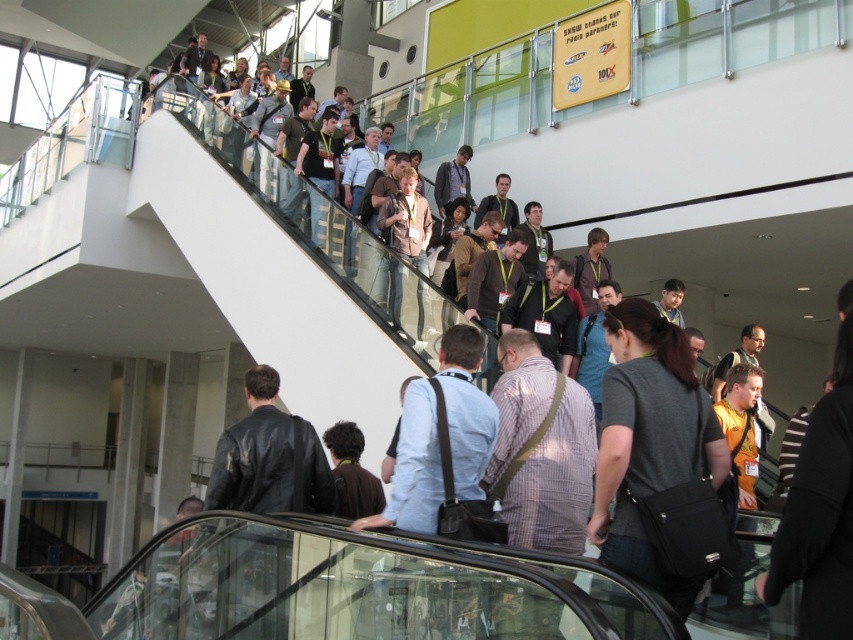
Question: Does dark gray fabric shirt at center lie behind leather jacket at center?

Choices:
 (A) no
 (B) yes

Answer: (A)

Question: Which of the following is the closest to the observer?

Choices:
 (A) (672, 444)
 (B) (271, 502)

Answer: (A)

Question: Is dark gray fabric shirt at center wider than leather jacket at center?

Choices:
 (A) yes
 (B) no

Answer: (B)

Question: Which of the following is the closest to the observer?

Choices:
 (A) leather jacket at center
 (B) dark gray fabric shirt at center

Answer: (B)

Question: Can you confirm if dark gray fabric shirt at center is thinner than leather jacket at center?

Choices:
 (A) no
 (B) yes

Answer: (B)

Question: Which point is closer to the camera?

Choices:
 (A) dark gray fabric shirt at center
 (B) leather jacket at center

Answer: (A)